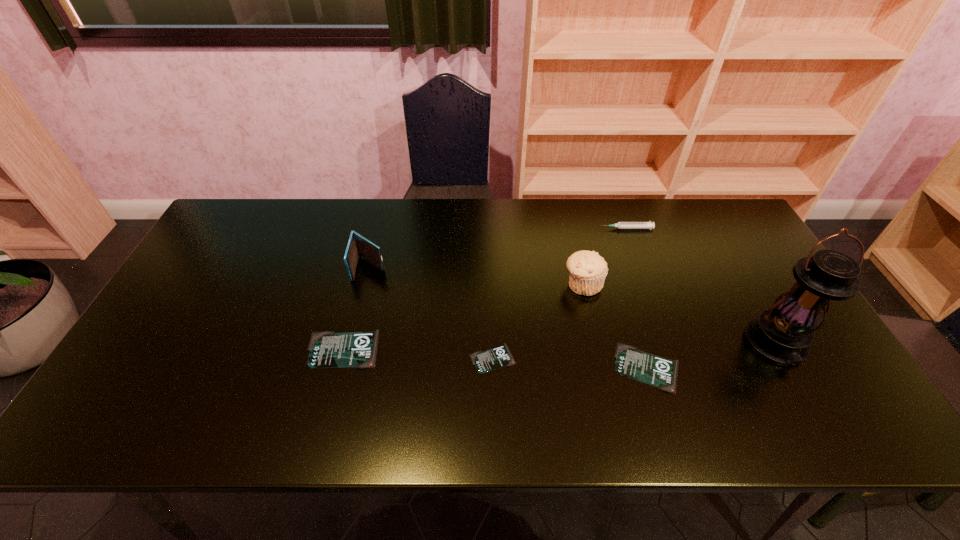
Locate an element on the screen. Image resolution: width=960 pixels, height=540 pixels. object present at the far edge is located at coordinates (620, 225).

The width and height of the screenshot is (960, 540). Identify the location of lantern that is at the near edge. (782, 334).

What are the coordinates of `object situated at the right edge` in the screenshot? It's located at (782, 334).

In order to click on object at the near right corner in this screenshot , I will do `click(782, 334)`.

At what (x,y) coordinates should I click in order to perform the action: click on vacant space at the far edge of the desktop. Please return your answer as a coordinate pair (x, y). Looking at the image, I should click on (x=559, y=239).

The image size is (960, 540). In order to click on vacant area at the left edge in this screenshot , I will do (187, 289).

In the image, there is a desktop. Where is `free region at the far left corner`? free region at the far left corner is located at coordinates (267, 227).

Find the location of `free space at the far right corner`. free space at the far right corner is located at coordinates (700, 208).

Find the location of `vacant space that is in between the second identity card from right to left and the fourth tallest object`. vacant space that is in between the second identity card from right to left and the fourth tallest object is located at coordinates (559, 293).

The width and height of the screenshot is (960, 540). I want to click on vacant space in between the fourth shortest object and the wallet, so click(x=498, y=248).